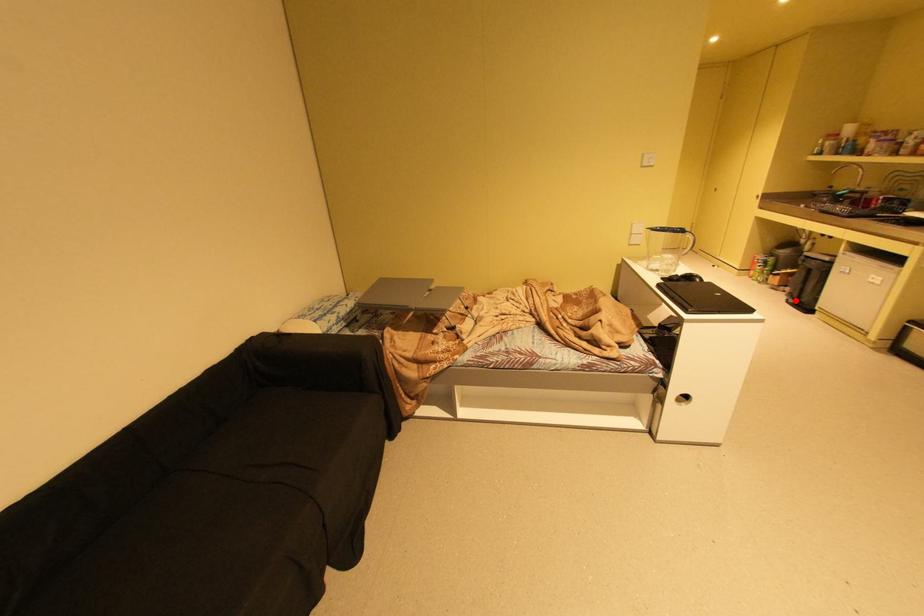
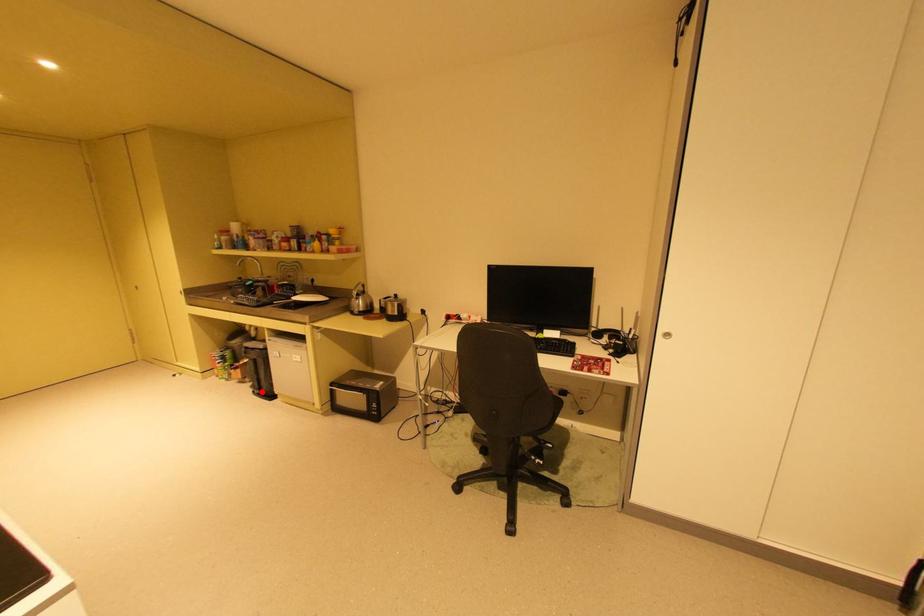
I am providing you with two images of the same scene from different viewpoints. A red point is marked on the first image and another point is marked on the second image. Is the red point in image1 aligned with the point shown in image2?

Yes